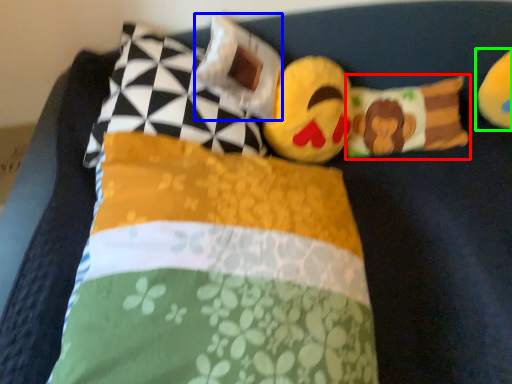
Question: Based on their relative distances, which object is farther from pillow (highlighted by a red box)? Choose from pillow (highlighted by a blue box) and toy (highlighted by a green box).

Choices:
 (A) pillow
 (B) toy

Answer: (A)